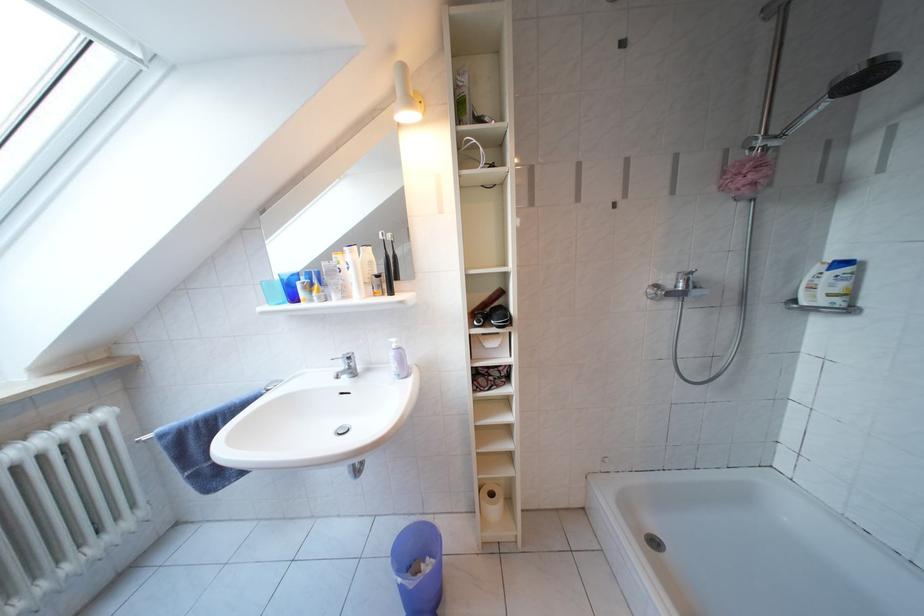
Where would you turn the shower valve handle? Please return your answer as a coordinate pair (x, y).

(695, 290)